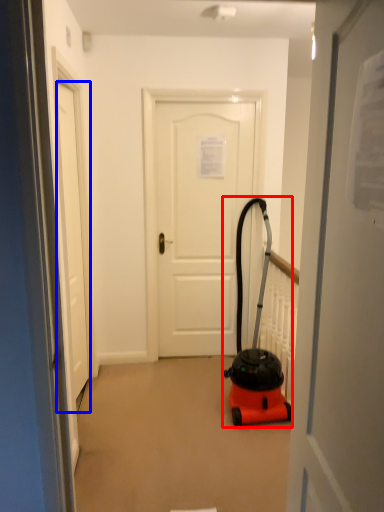
Question: Which point is closer to the camera, equipment (highlighted by a red box) or door (highlighted by a blue box)?

Choices:
 (A) equipment
 (B) door

Answer: (B)